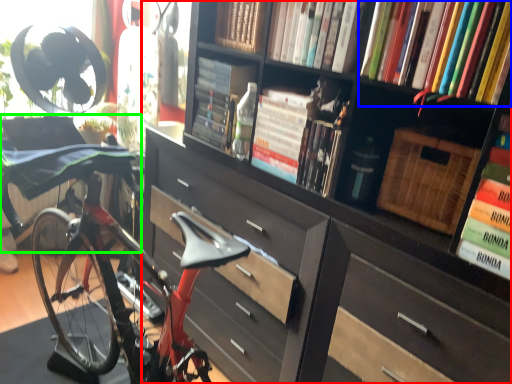
Question: Which is nearer to the bookcase (highlighted by a red box)? book (highlighted by a blue box) or swivel chair (highlighted by a green box).

Choices:
 (A) book
 (B) swivel chair

Answer: (A)